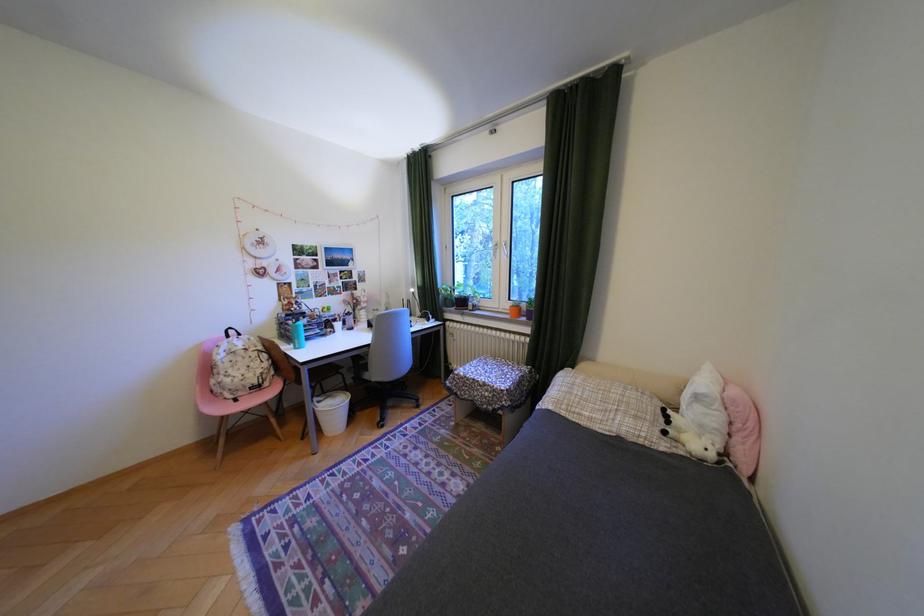
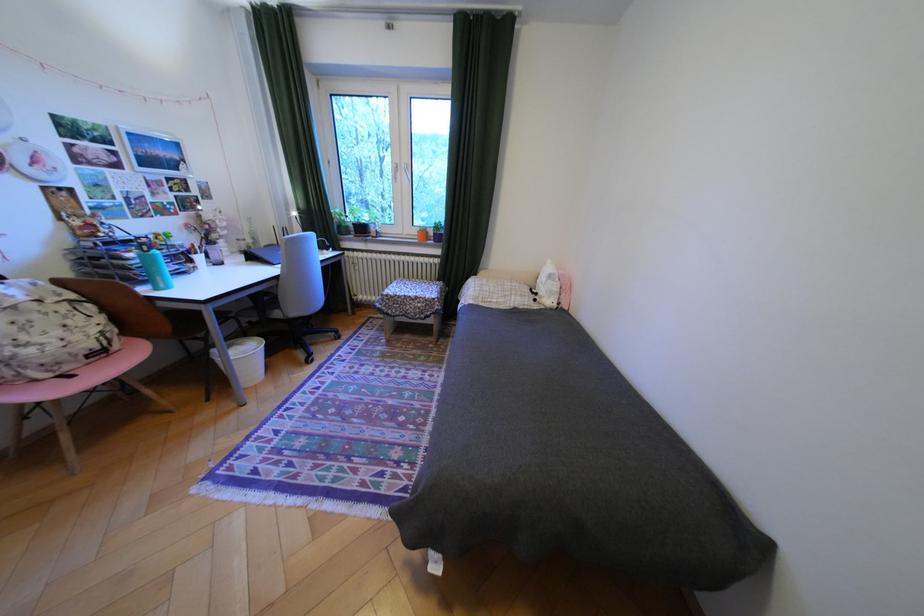
Where in the second image is the point corresponding to (251,394) from the first image?

(79, 368)